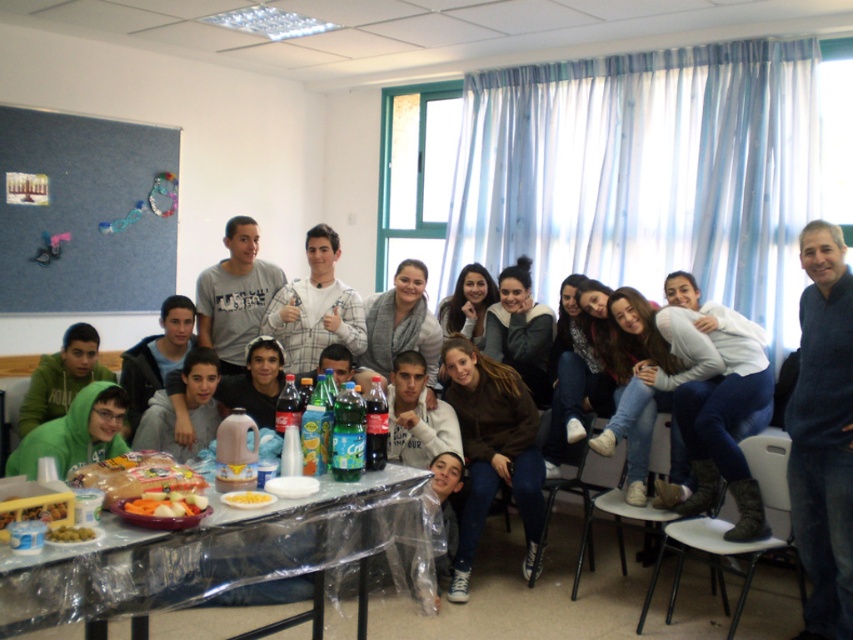
Question: Which point appears farthest from the camera in this image?

Choices:
 (A) (213, 572)
 (B) (39, 208)
 (C) (73, 531)

Answer: (B)

Question: Does smooth plastic plate at lower center appear on the right side of yellow matte corn at center?

Choices:
 (A) yes
 (B) no

Answer: (B)

Question: Among these objects, which one is nearest to the camera?

Choices:
 (A) smooth plastic container of mixed vegetables at center
 (B) dark blue sweater at right
 (C) smooth plastic plate at lower center
 (D) plaid shirt at center

Answer: (A)

Question: Does smooth plastic plate at lower center have a greater width compared to smooth plastic container of mixed vegetables at center?

Choices:
 (A) no
 (B) yes

Answer: (B)

Question: Does dark blue sweater at right appear on the left side of smooth plastic container of mixed vegetables at center?

Choices:
 (A) yes
 (B) no

Answer: (B)

Question: Which point is farther to the camera?

Choices:
 (A) yellow matte corn at center
 (B) green matte olives at lower left

Answer: (A)